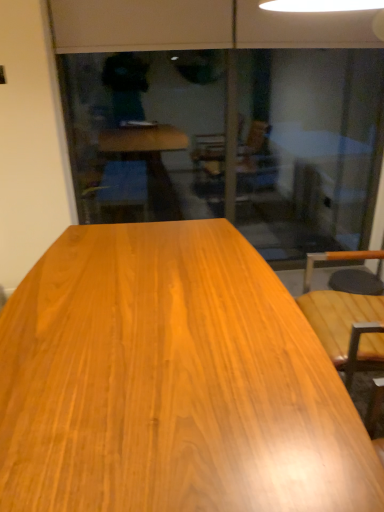
Question: Is transparent glass screen door at center wider or thinner than glossy wood table at center?

Choices:
 (A) thin
 (B) wide

Answer: (A)

Question: Considering the positions of transparent glass screen door at center and glossy wood table at center in the image, is transparent glass screen door at center bigger or smaller than glossy wood table at center?

Choices:
 (A) big
 (B) small

Answer: (B)

Question: Is transparent glass screen door at center inside the boundaries of glossy wood table at center, or outside?

Choices:
 (A) inside
 (B) outside

Answer: (B)

Question: From a real-world perspective, is glossy wood table at center physically located above or below transparent glass screen door at center?

Choices:
 (A) below
 (B) above

Answer: (A)

Question: Is glossy wood table at center in front of or behind transparent glass screen door at center in the image?

Choices:
 (A) behind
 (B) front

Answer: (B)

Question: Is glossy wood table at center situated inside transparent glass screen door at center or outside?

Choices:
 (A) inside
 (B) outside

Answer: (B)

Question: Does point click(x=213, y=414) appear closer or farther from the camera than point click(x=142, y=64)?

Choices:
 (A) farther
 (B) closer

Answer: (B)